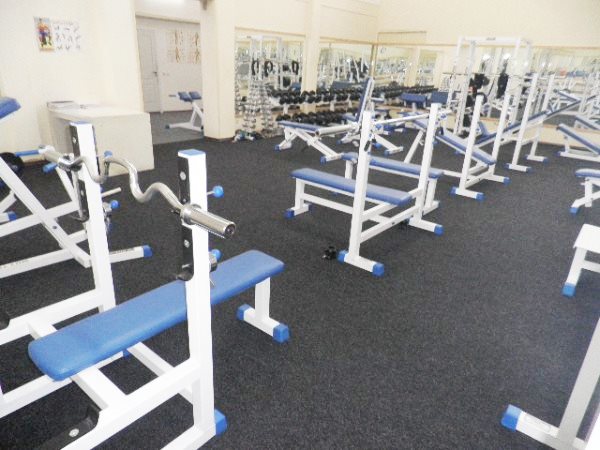
This screenshot has height=450, width=600. Identify the location of blue benches. (172, 297), (341, 176), (412, 166), (456, 140).